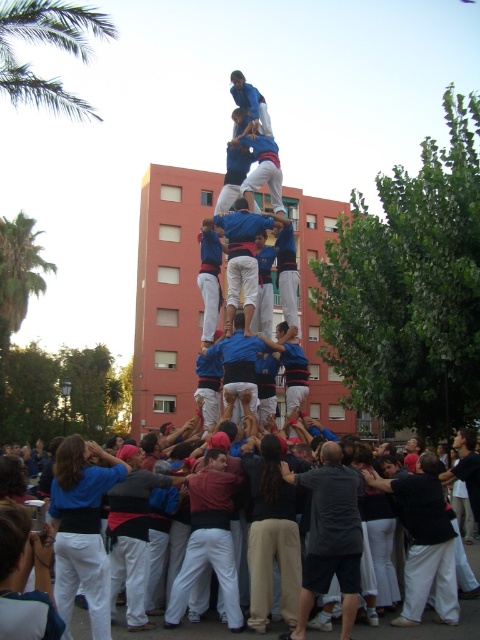
Question: Which of these objects is positioned farthest from the green leafy palm tree at upper left?

Choices:
 (A) blue fabric man at center
 (B) dark gray shirt at center
 (C) black cotton shirt at lower right

Answer: (C)

Question: Is the position of dark blue shirt at center more distant than that of green leafy palm tree at left?

Choices:
 (A) no
 (B) yes

Answer: (A)

Question: Estimate the real-world distances between objects in this image. Which object is farther from the dark blue shirt at center?

Choices:
 (A) green leafy palm tree at left
 (B) black cotton shirt at lower right
 (C) dark gray shirt at center
 (D) green leafy palm tree at upper left

Answer: (A)

Question: Can you confirm if black cotton shirt at lower right is positioned above blue fabric at center?

Choices:
 (A) yes
 (B) no

Answer: (B)

Question: Among these points, which one is farthest from the camera?

Choices:
 (A) (168, 600)
 (B) (227, 378)
 (C) (421, 589)
 (D) (357, 563)

Answer: (B)

Question: Can you confirm if dark gray shirt at center is wider than green leafy palm tree at left?

Choices:
 (A) yes
 (B) no

Answer: (B)